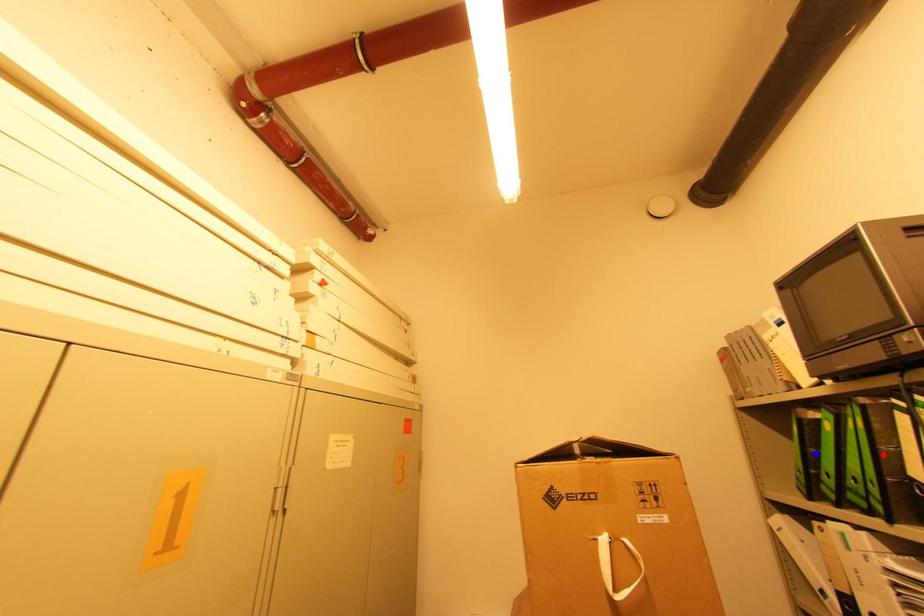
Question: Two points are marked on the image. Which point is closer to the camera?

Choices:
 (A) Blue point is closer.
 (B) Red point is closer.

Answer: (B)